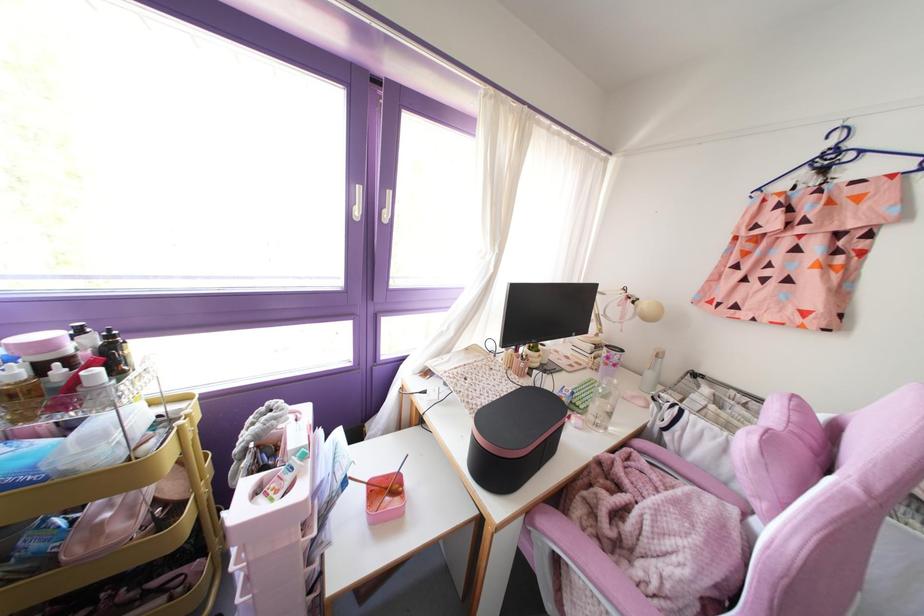
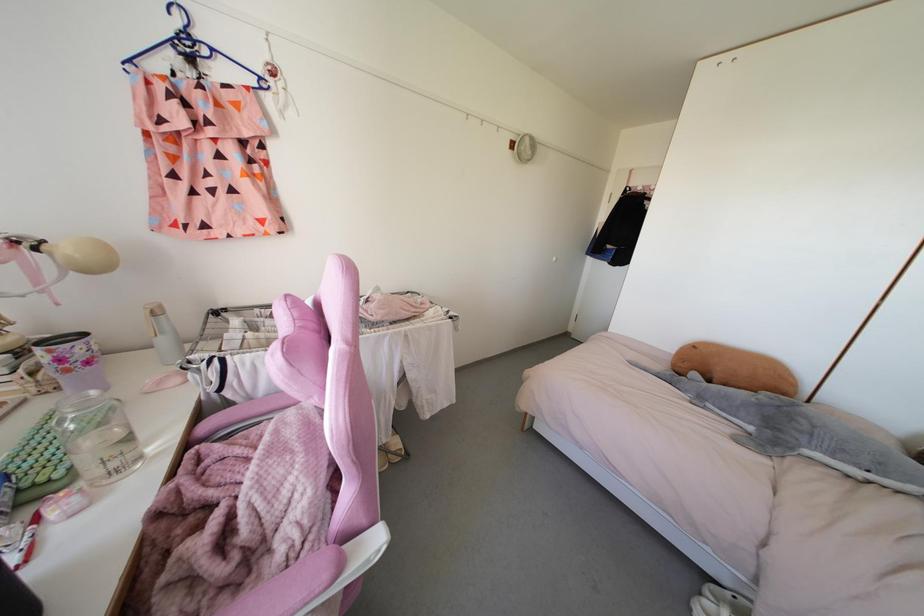
Where in the second image is the point corresponding to (x=817, y=180) from the first image?

(191, 73)